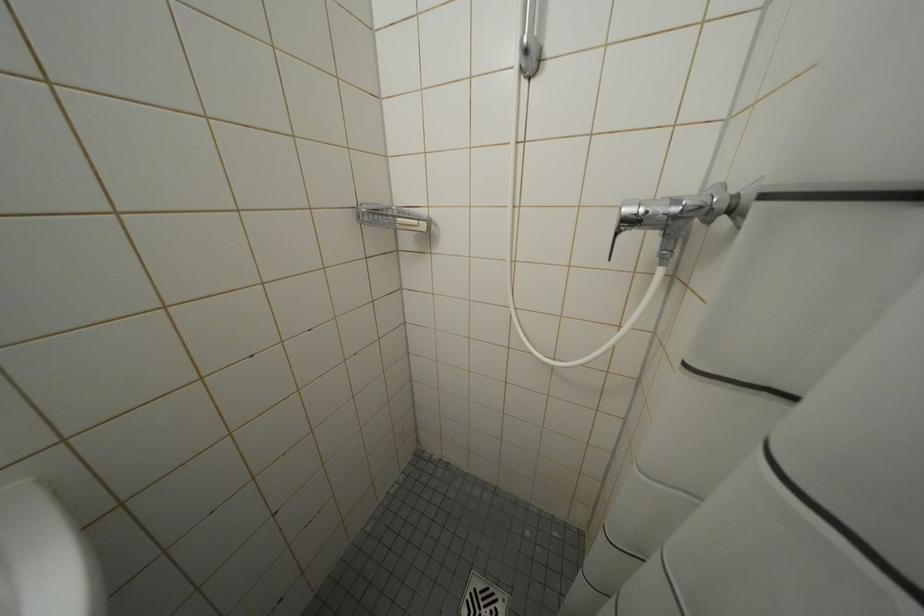
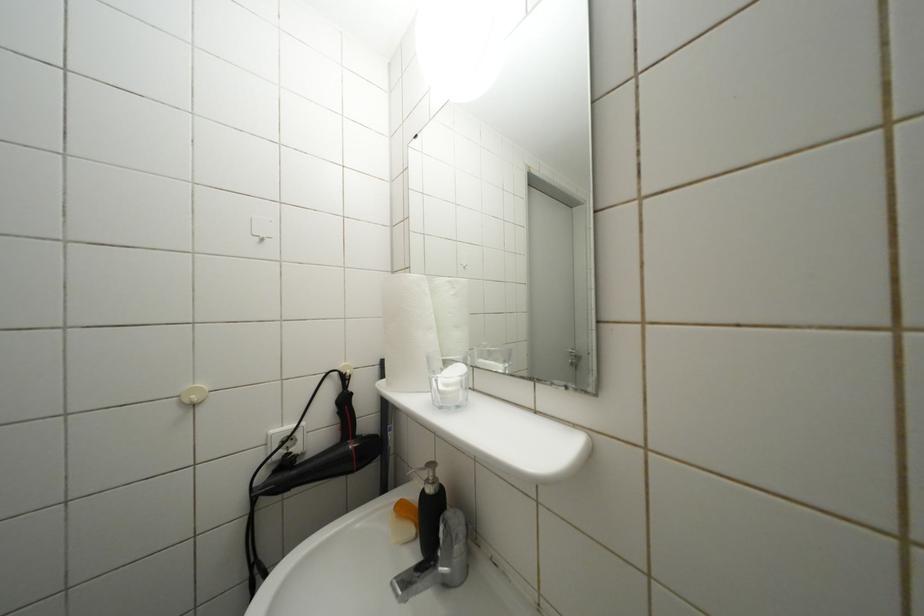
Question: The camera is either moving clockwise (left) or counter-clockwise (right) around the object. The first image is from the beginning of the video and the second image is from the end. Is the camera moving left or right when shooting the video?

Choices:
 (A) Left
 (B) Right

Answer: (B)